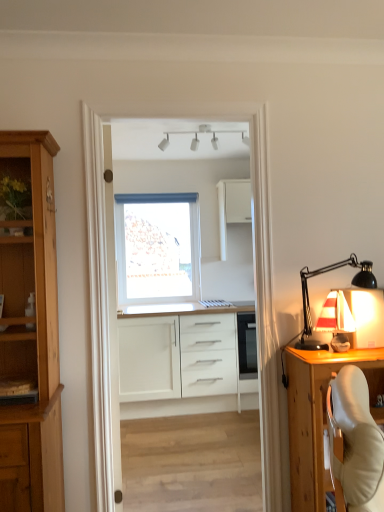
Question: Is the depth of white fabric lampshade at right, which appears as the second lamp when viewed from the left, greater than that of white matte window at center?

Choices:
 (A) no
 (B) yes

Answer: (A)

Question: From a real-world perspective, does white fabric lampshade at right, arranged as the 2th lamp when viewed from the top, sit lower than white matte window at center?

Choices:
 (A) no
 (B) yes

Answer: (B)

Question: Considering the relative positions of white fabric lampshade at right, arranged as the 2th lamp when viewed from the back, and white matte window at center in the image provided, is white fabric lampshade at right, arranged as the 2th lamp when viewed from the back, to the left of white matte window at center from the viewer's perspective?

Choices:
 (A) yes
 (B) no

Answer: (B)

Question: Is white fabric lampshade at right, arranged as the 2th lamp when viewed from the top, with white matte window at center?

Choices:
 (A) no
 (B) yes

Answer: (A)

Question: From the image's perspective, is white fabric lampshade at right, the 1th lamp from the right, located beneath white matte window at center?

Choices:
 (A) no
 (B) yes

Answer: (B)

Question: Is white fabric lampshade at right, arranged as the 2th lamp when viewed from the top, shorter than white matte window at center?

Choices:
 (A) no
 (B) yes

Answer: (B)

Question: Is wooden cabinet at right, acting as the 2th cabinetry starting from the bottom, thinner than white matte track lights at upper center, which appears as the 1th lamp when viewed from the back?

Choices:
 (A) no
 (B) yes

Answer: (A)

Question: From a real-world perspective, is wooden cabinet at right, acting as the 2th cabinetry starting from the bottom, on white matte track lights at upper center, the first lamp viewed from the top?

Choices:
 (A) no
 (B) yes

Answer: (A)

Question: Does wooden cabinet at right, arranged as the 1th cabinetry when viewed from the front, have a larger size compared to white matte track lights at upper center, acting as the 2th lamp starting from the right?

Choices:
 (A) yes
 (B) no

Answer: (A)

Question: Does wooden cabinet at right, arranged as the 1th cabinetry when viewed from the front, have a greater height compared to white matte track lights at upper center, the first lamp in the left-to-right sequence?

Choices:
 (A) no
 (B) yes

Answer: (B)

Question: Can you confirm if wooden cabinet at right, arranged as the 1th cabinetry when viewed from the front, is smaller than white matte track lights at upper center, which is the second lamp in front-to-back order?

Choices:
 (A) no
 (B) yes

Answer: (A)

Question: Are wooden cabinet at right, acting as the second cabinetry starting from the top, and white matte track lights at upper center, the first lamp viewed from the top, far apart?

Choices:
 (A) yes
 (B) no

Answer: (A)

Question: Does white matte window at center have a smaller size compared to matte white sailboat at right?

Choices:
 (A) yes
 (B) no

Answer: (B)